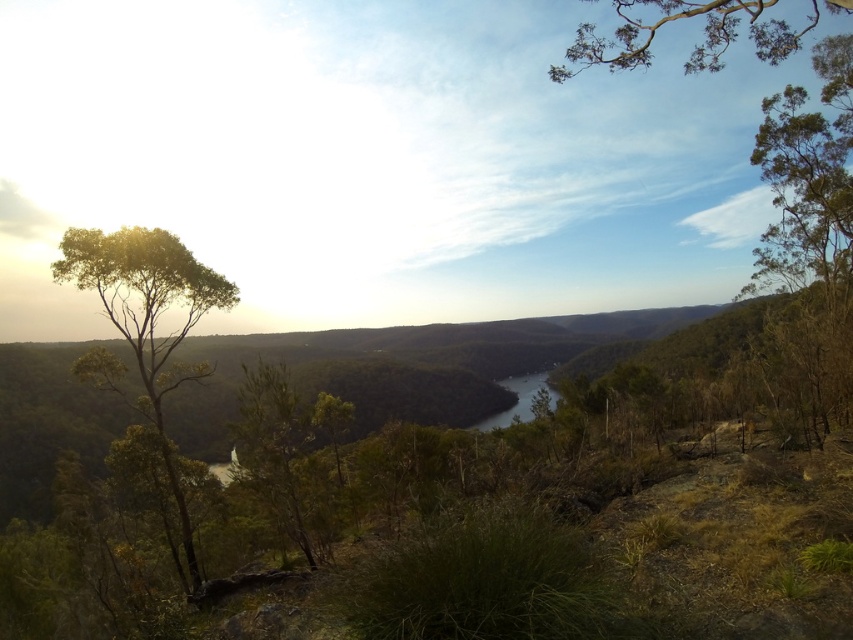
Question: Is green leafy tree at left positioned in front of green leafy tree at upper right?

Choices:
 (A) yes
 (B) no

Answer: (B)

Question: Does green leafy tree at left have a greater width compared to shiny dark water at center?

Choices:
 (A) no
 (B) yes

Answer: (A)

Question: Which object is positioned closest to the green leafy tree at upper right?

Choices:
 (A) shiny dark water at center
 (B) green leafy tree at left

Answer: (B)

Question: Among these objects, which one is nearest to the camera?

Choices:
 (A) shiny dark water at center
 (B) green leafy tree at upper right

Answer: (B)

Question: Is green leafy tree at left positioned before shiny dark water at center?

Choices:
 (A) yes
 (B) no

Answer: (A)

Question: Which point is closer to the camera taking this photo?

Choices:
 (A) (132, 321)
 (B) (604, 58)
 (C) (521, 378)

Answer: (B)